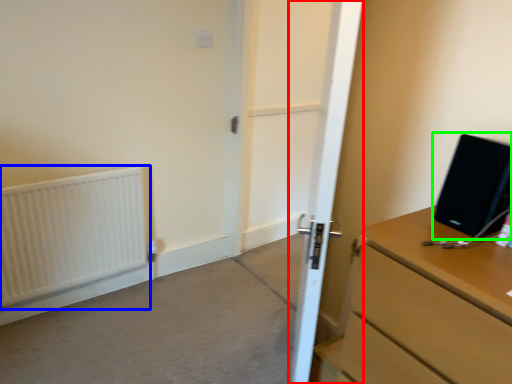
Question: Considering the real-world distances, which object is farthest from door (highlighted by a red box)? radiator (highlighted by a blue box) or desktop computer (highlighted by a green box)?

Choices:
 (A) radiator
 (B) desktop computer

Answer: (A)